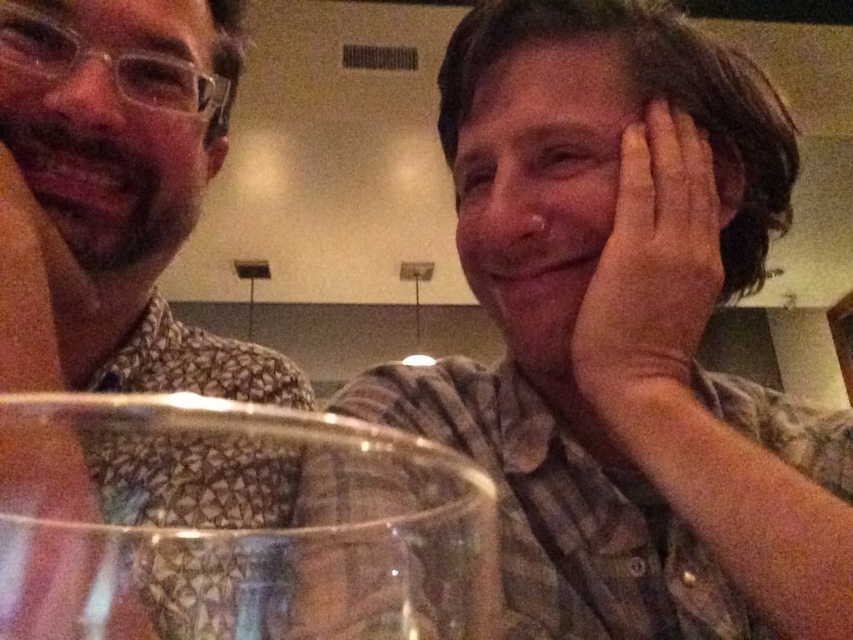
Locate an element on the screen. The width and height of the screenshot is (853, 640). patterned shirt at left is located at coordinates (115, 195).

Does patterned shirt at left have a smaller size compared to pink skin at right?

Incorrect, patterned shirt at left is not smaller in size than pink skin at right.

Does point (300, 372) lie behind point (657, 356)?

Yes, point (300, 372) is behind point (657, 356).

Find the location of a particular element. The height and width of the screenshot is (640, 853). patterned shirt at left is located at coordinates (115, 195).